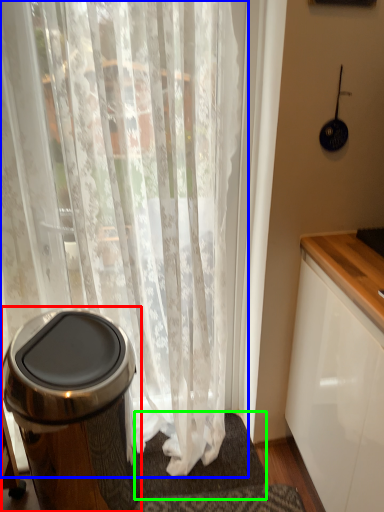
Question: Which object is the farthest from waste container (highlighted by a red box)? Choose among these: curtain (highlighted by a blue box) or bath mat (highlighted by a green box).

Choices:
 (A) curtain
 (B) bath mat

Answer: (B)